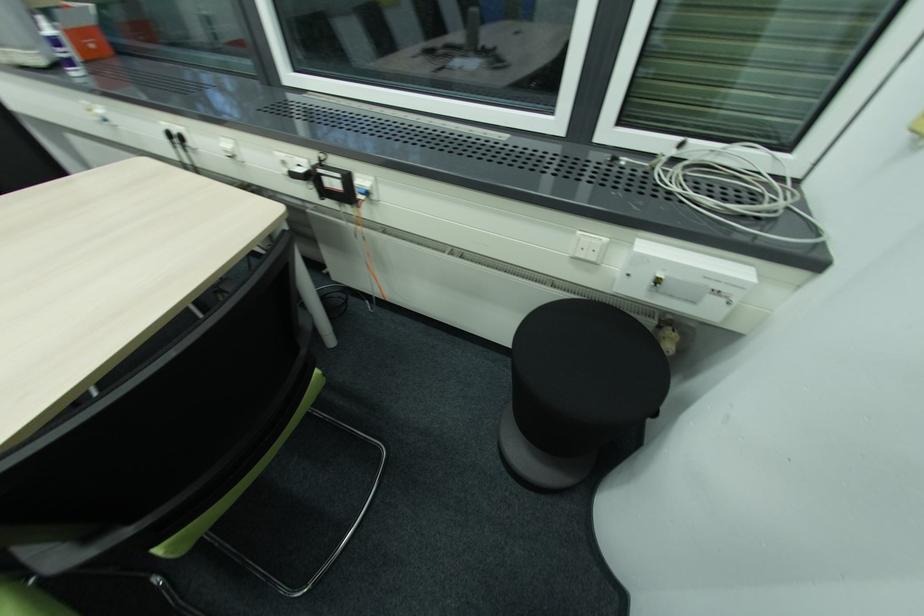
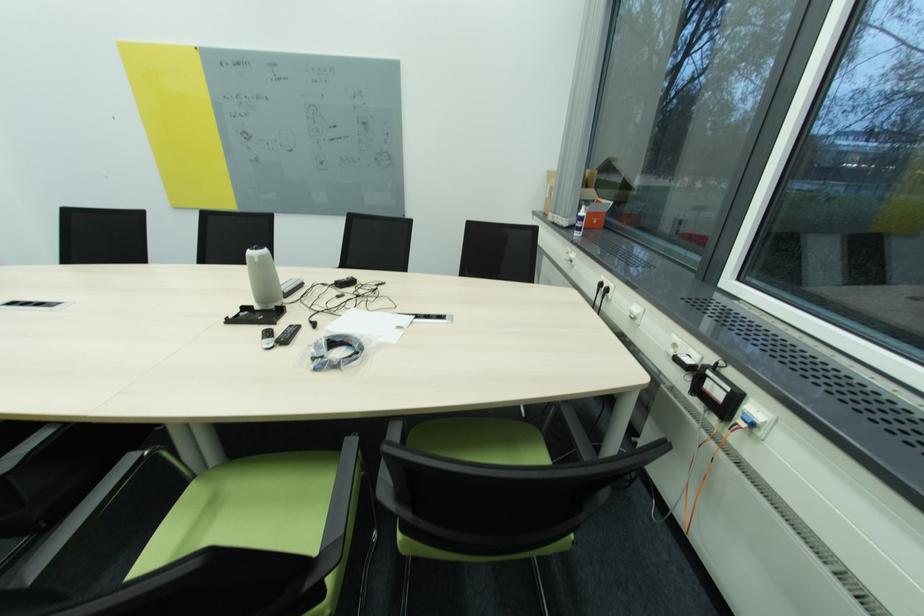
In the second image, find the point that corresponds to [287,163] in the first image.

(679, 346)